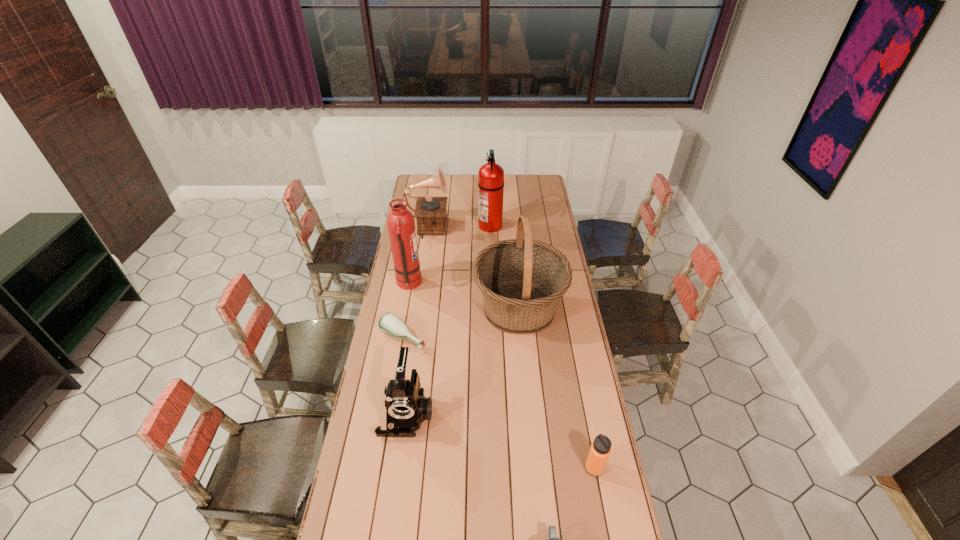
The width and height of the screenshot is (960, 540). Identify the location of vacant space positioned 0.350m at the nozzle of the farther fire extinguisher. (417, 225).

Find the location of a particular element. This screenshot has height=540, width=960. vacant space situated 0.220m at the nozzle of the farther fire extinguisher is located at coordinates click(x=440, y=225).

You are a GUI agent. You are given a task and a screenshot of the screen. Output one action in this format:
    pyautogui.click(x=<x>, y=<y>)
    Task: Click on the vacant space located on the front of the basket
    
    Given the screenshot: What is the action you would take?
    pyautogui.click(x=530, y=426)

Locate an element on the screen. vacant space located 0.250m on the label side of the left fire extinguisher is located at coordinates (473, 284).

At what (x,y) coordinates should I click in order to perform the action: click on free spot located 0.210m on the horn of the fourth tallest object. Please return your answer as a coordinate pair (x, y). Looking at the image, I should click on (486, 231).

This screenshot has height=540, width=960. Find the location of `vacant region located on the lens mount of the sixth farthest object`. vacant region located on the lens mount of the sixth farthest object is located at coordinates (394, 514).

Identify the location of free space located 0.220m on the back of the thermos bottle. This screenshot has width=960, height=540. (581, 402).

Find the location of a particular element. The width and height of the screenshot is (960, 540). vacant region located 0.260m on the back of the bottle is located at coordinates (413, 283).

This screenshot has height=540, width=960. In order to click on fire extinguisher that is at the left edge in this screenshot , I will do `click(401, 225)`.

Find the location of a particular element. record player located in the left edge section of the desktop is located at coordinates (430, 212).